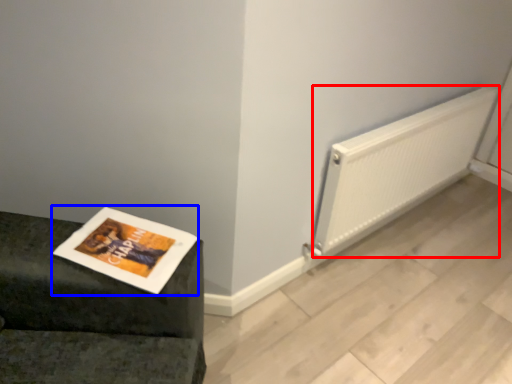
Question: Which point is closer to the camera, radiator (highlighted by a red box) or magazine (highlighted by a blue box)?

Choices:
 (A) radiator
 (B) magazine

Answer: (B)